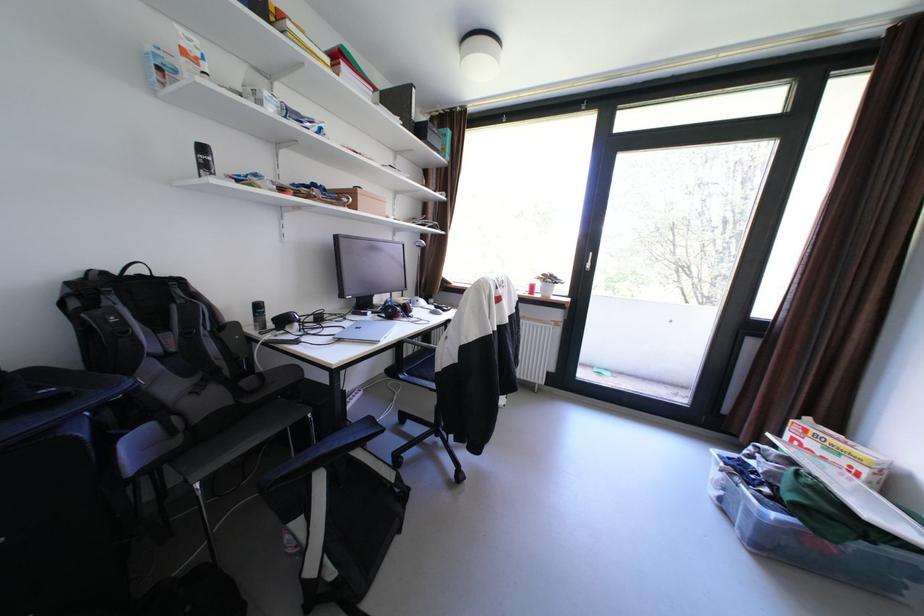
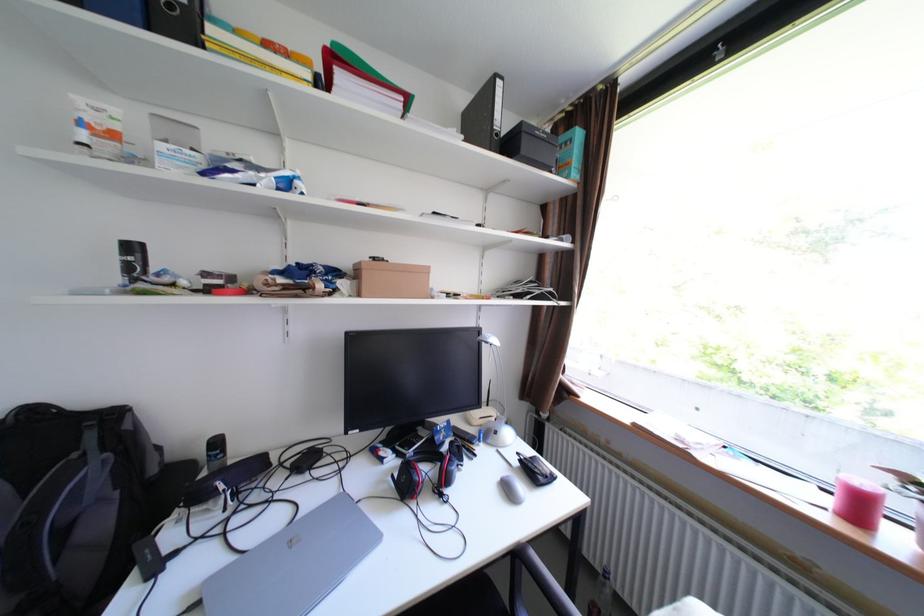
The point at (349,341) is marked in the first image. Where is the corresponding point in the second image?

(208, 604)